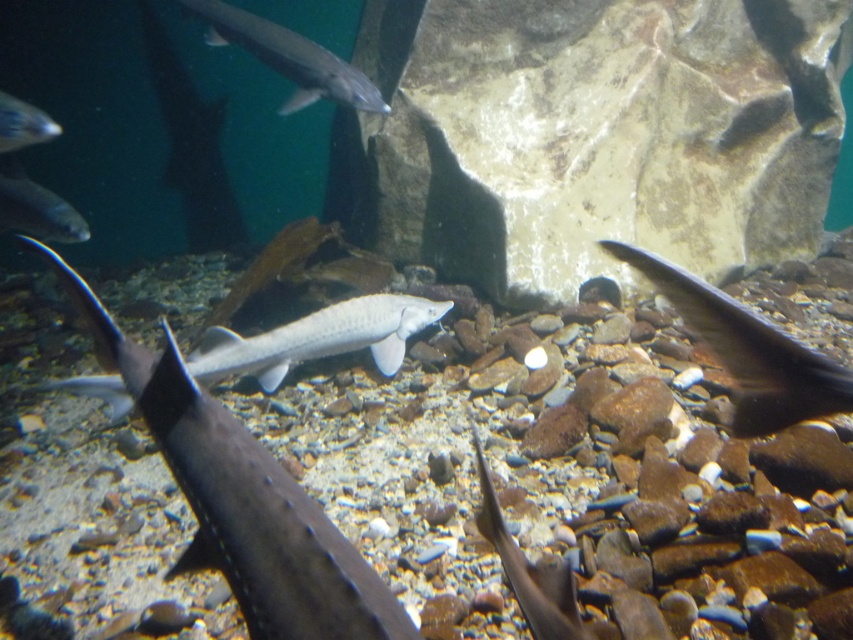
Question: Is white marble rock at center closer to the viewer compared to matte gray fish at upper left?

Choices:
 (A) yes
 (B) no

Answer: (B)

Question: Which object is positioned closest to the white marble rock at center?

Choices:
 (A) matte gray fish at upper left
 (B) smooth gray fish at center
 (C) white smooth fish at center
 (D) shiny black fish at center

Answer: (C)

Question: Based on their relative distances, which object is nearer to the shiny black fish at center?

Choices:
 (A) translucent gray fish at center
 (B) white marble rock at center
 (C) matte gray fish at upper left
 (D) smooth gray fish at center

Answer: (A)

Question: Which of the following is the farthest from the observer?

Choices:
 (A) shiny black fish at center
 (B) smooth gray fish at center
 (C) white smooth fish at center
 (D) silvery metallic fish at upper left

Answer: (D)

Question: From the image, what is the correct spatial relationship of smooth gray fish at center in relation to matte gray fish at upper left?

Choices:
 (A) above
 (B) below

Answer: (B)

Question: Can you confirm if smooth gray fish at center is positioned below white smooth fish at center?

Choices:
 (A) yes
 (B) no

Answer: (A)